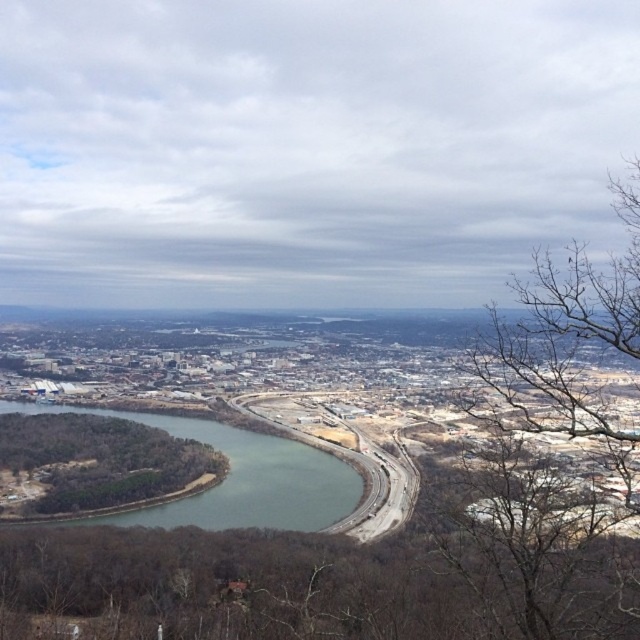
Can you confirm if green leafy tree at lower left is bigger than green water at center?

No.

Which is in front, point (168, 472) or point (243, 490)?

Point (243, 490) is in front.

Find the location of a particular element. green leafy tree at lower left is located at coordinates (99, 461).